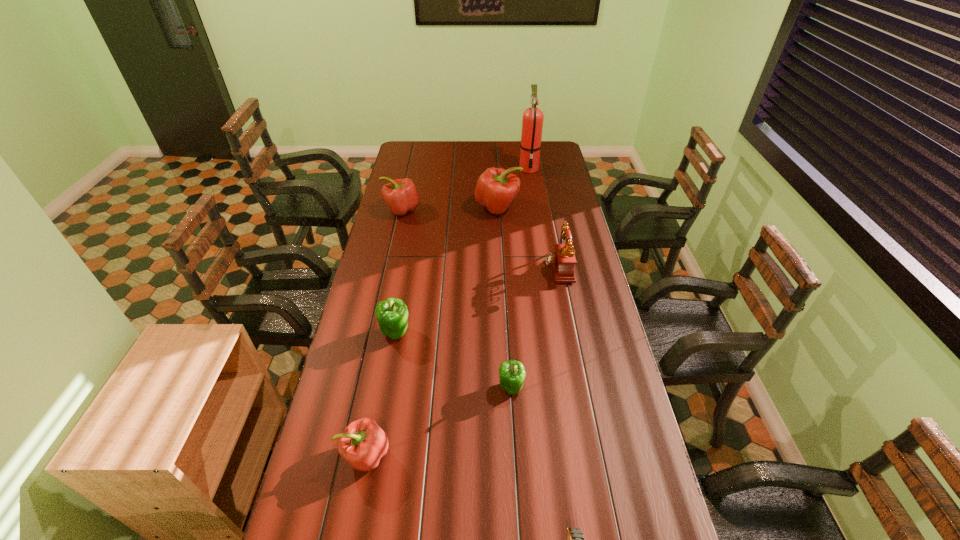
You are a GUI agent. You are given a task and a screenshot of the screen. Output one action in this format:
    pyautogui.click(x=<x>, y=<y>)
    Task: Click on the blank region between the second biggest pink bell pepper and the fifth nearest object
    The height and width of the screenshot is (540, 960).
    Given the screenshot: What is the action you would take?
    pyautogui.click(x=480, y=239)

Where is `free space between the second nearest bell pepper and the farthest object`? The image size is (960, 540). free space between the second nearest bell pepper and the farthest object is located at coordinates (520, 278).

I want to click on vacant space in between the second biggest pink bell pepper and the fire extinguisher, so click(465, 189).

Choose which object is the fifth nearest neighbor to the rightmost pink bell pepper. Please provide its 2D coordinates. Your answer should be formatted as a tuple, i.e. [(x, y)], where the tuple contains the x and y coordinates of a point satisfying the conditions above.

[(512, 374)]

Find the location of a particular element. The image size is (960, 540). object that is the seventh nearest to the seventh farthest object is located at coordinates (532, 121).

Where is `bell pepper that is the second closest to the biggest pink bell pepper`? bell pepper that is the second closest to the biggest pink bell pepper is located at coordinates (392, 315).

Find the location of a particular element. This screenshot has width=960, height=540. bell pepper object that ranks as the fourth closest to the third nearest object is located at coordinates (400, 195).

Locate an element on the screen. The width and height of the screenshot is (960, 540). pink bell pepper that is the second closest to the smallest pink bell pepper is located at coordinates (496, 189).

This screenshot has width=960, height=540. Identify the location of pink bell pepper object that ranks as the closest to the rightmost pink bell pepper. (400, 195).